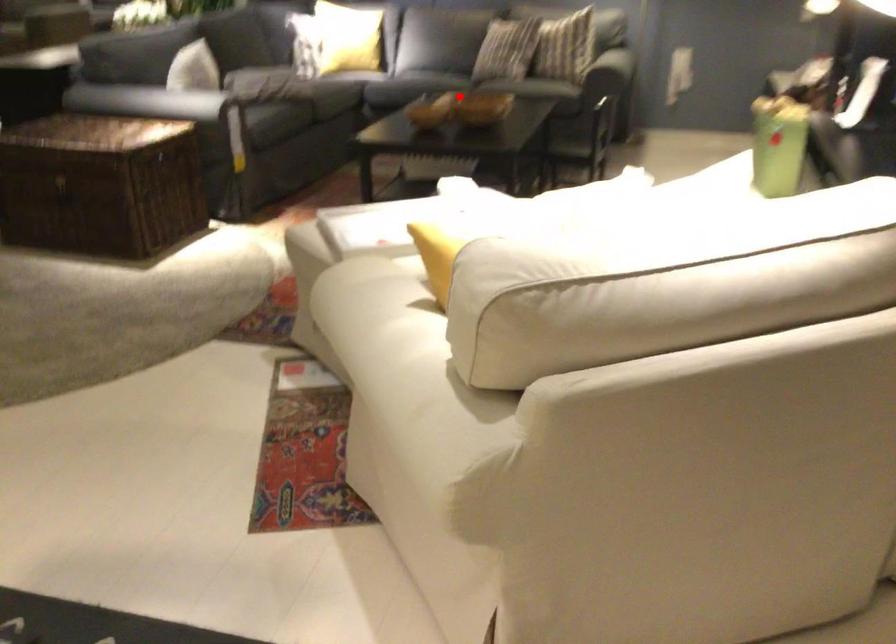
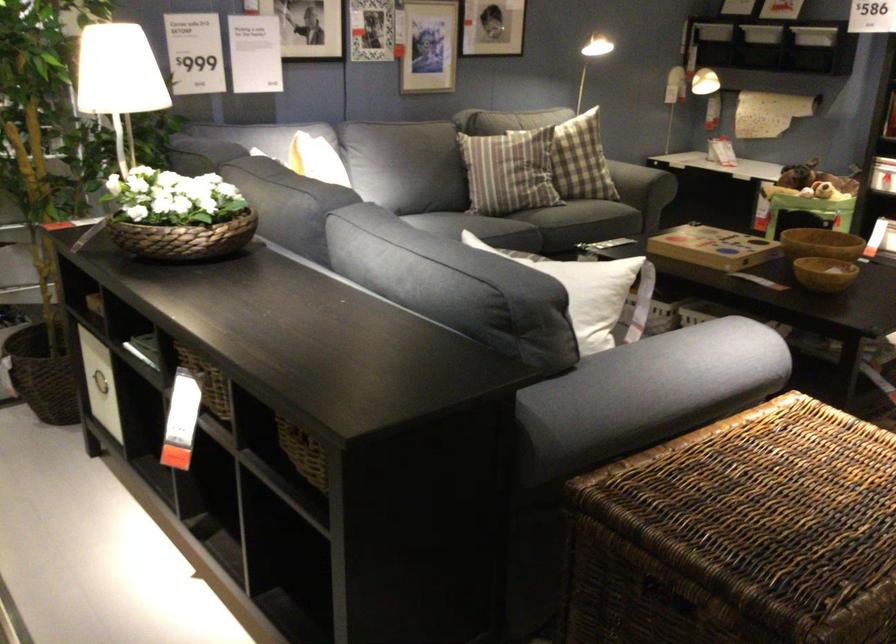
Question: I am providing you with two images of the same scene from different viewpoints. In image1, a red point is highlighted. Considering the same 3D point in image2, which of the following is correct?

Choices:
 (A) It is closer
 (B) It is farther

Answer: (A)